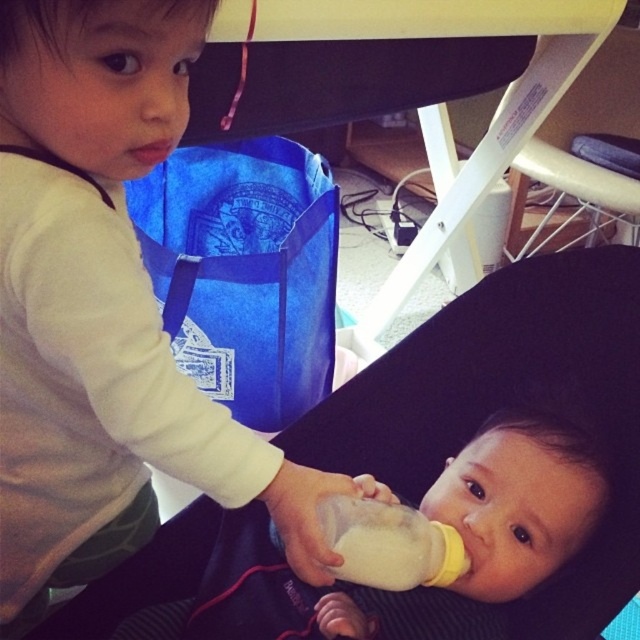
Consider the image. You are a parent trying to choose between two baby bottles for your child. The smooth plastic bottle at center and the white matte bottle at center are both available. Based on the image, which one has a wider opening for easier cleaning?

The smooth plastic bottle at center has a larger width than the white matte bottle at center, so it has a wider opening for easier cleaning.

You are a parent standing in the room and want to place a 24 inch long toy box in the space where point (17, 440) is located. Can you fit the toy box there?

The point (17, 440) is 26.86 inches from the viewer, so yes, the 24 inch long toy box can fit there since it is shorter than the available space.

You are a parent trying to locate the baby bottle. Based on the image, where is the white matte baby bottle at lower center located relative to the point at coordinates (106, 310)?

The point at coordinates (106, 310) is on the white matte baby bottle at lower center, so the bottle is exactly at that location.